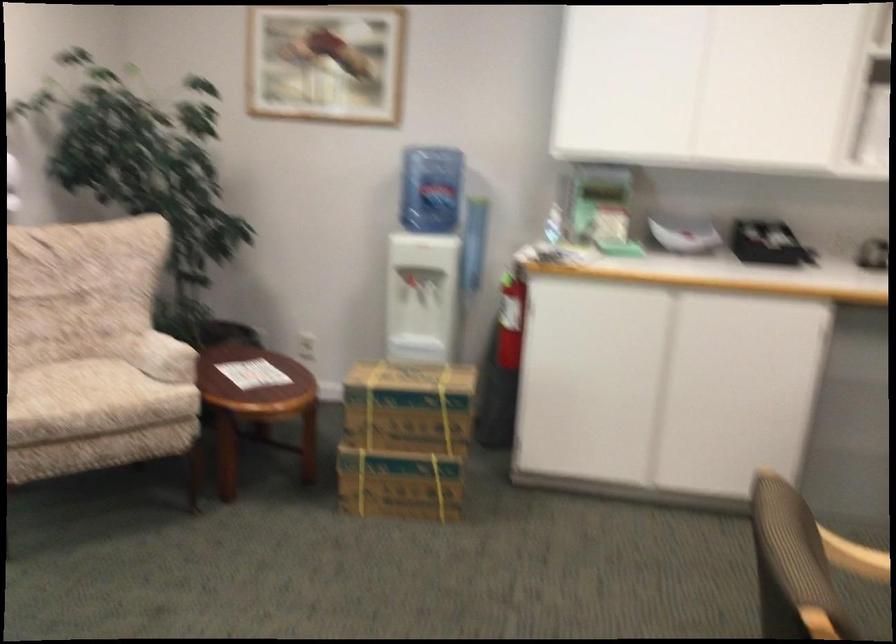
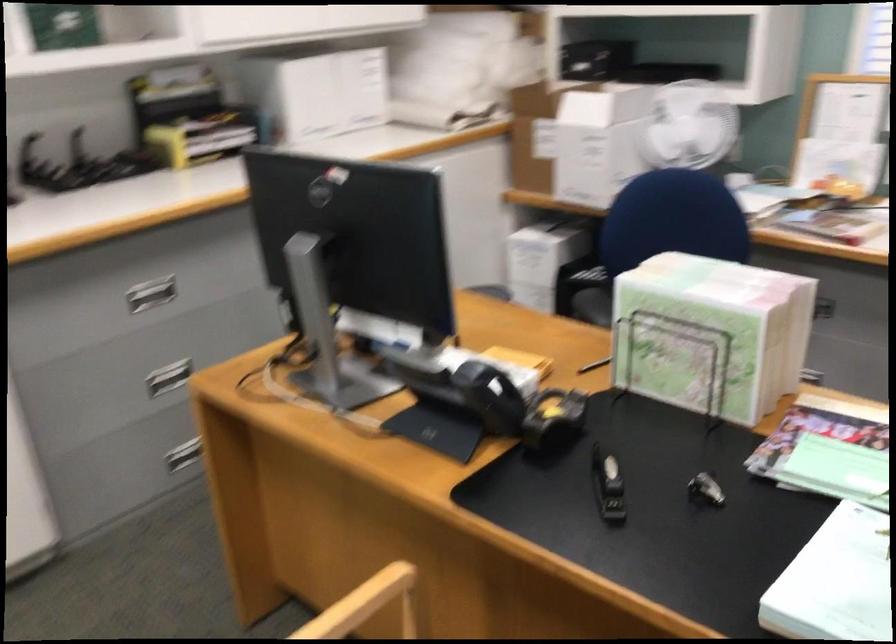
Based on the continuous images, in which direction is the camera rotating?

The rotation direction of the camera is right-down.